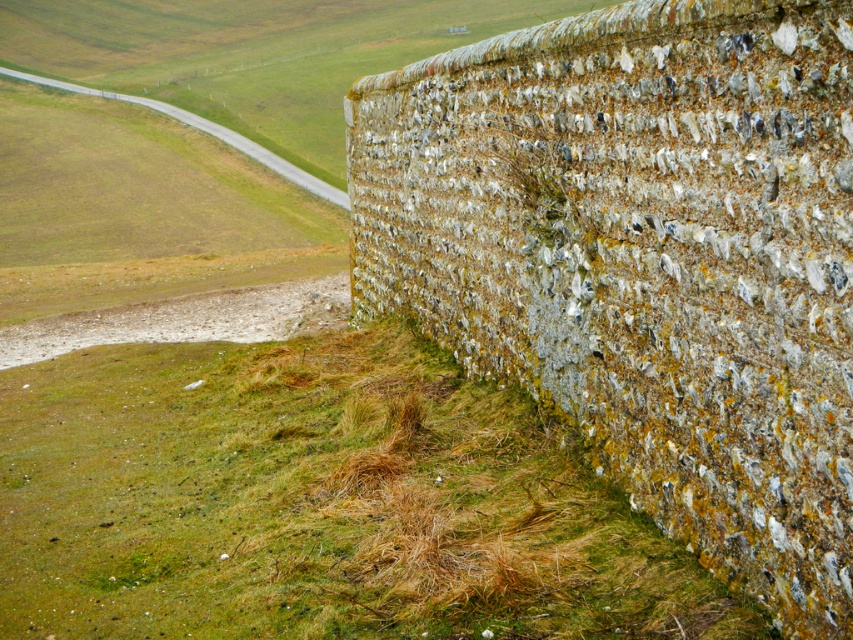
You are a landscape architect assessing a property. You notice the speckled stone wall at right and the green mossy grass at lower left. Which area would require more space for maintenance equipment access, considering their sizes?

The green mossy grass at lower left requires more space for maintenance equipment access because it is larger than the speckled stone wall at right.

You are standing in front of a stone wall and want to place a small potted plant at point (645, 259). Based on the scene description, what will the plant be placed on?

The plant will be placed on the speckled stone wall at right located at point (645, 259).

You are a gardener assessing the terrain. The speckled stone wall at right and the green mossy grass at lower left are part of the landscape. Which object is shorter in height?

The speckled stone wall at right is shorter in height compared to the green mossy grass at lower left.